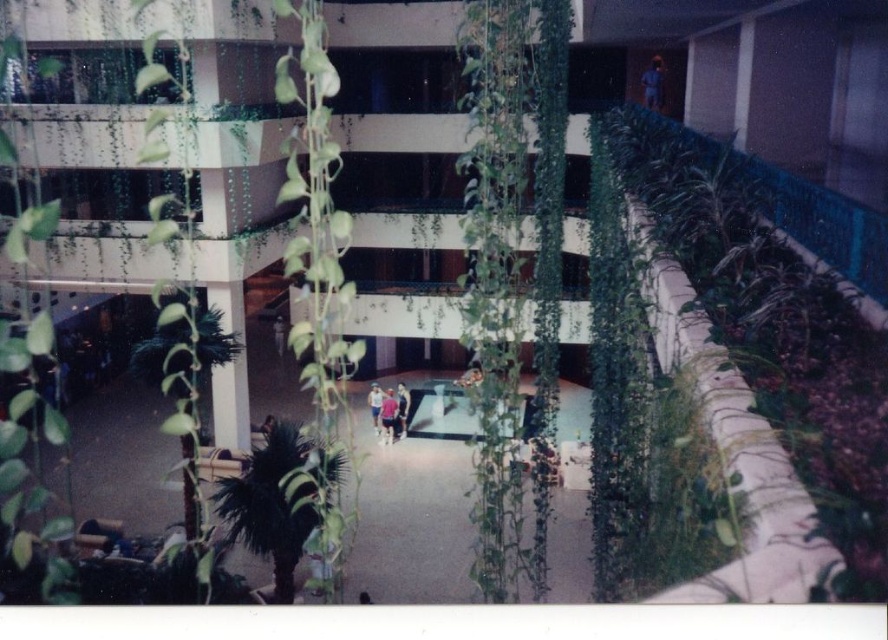
Question: Considering the relative positions of light pink fabric at center and dark blue shirt at center in the image provided, where is light pink fabric at center located with respect to dark blue shirt at center?

Choices:
 (A) below
 (B) above

Answer: (A)

Question: Which point is farther to the camera?

Choices:
 (A) pos(649,81)
 (B) pos(259,536)
 (C) pos(377,408)
 (D) pos(734,173)

Answer: (A)

Question: Observing the image, what is the correct spatial positioning of light pink fabric at center in reference to white cotton shirt at center?

Choices:
 (A) right
 (B) left

Answer: (A)

Question: Which object is closer to the camera taking this photo?

Choices:
 (A) white cotton shirt at center
 (B) green leafy plant at lower left
 (C) light pink fabric at center

Answer: (B)

Question: Among these objects, which one is nearest to the camera?

Choices:
 (A) blue fabric person at upper center
 (B) green leafy plant at right
 (C) white cotton shirt at center
 (D) green leafy plant at lower left

Answer: (B)

Question: Can you confirm if white glossy table at center is positioned below matte pink shorts at center?

Choices:
 (A) no
 (B) yes

Answer: (A)